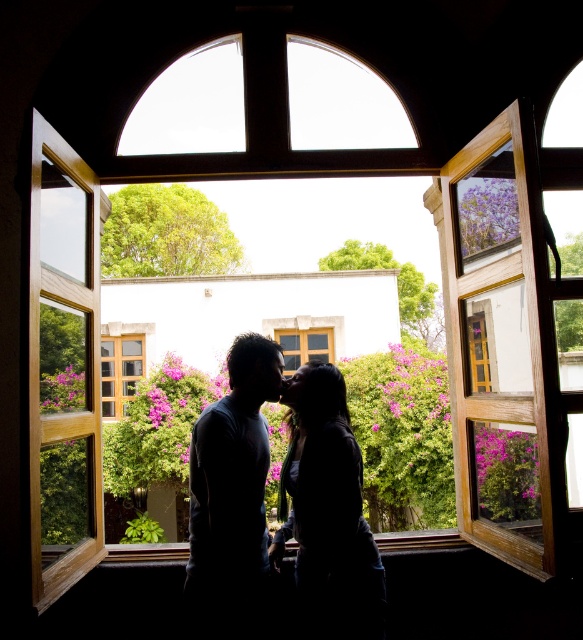
Question: Observing the image, what is the correct spatial positioning of black matte couple at center in reference to wooden frame at left?

Choices:
 (A) below
 (B) above

Answer: (A)

Question: Which of the following is the farthest from the observer?

Choices:
 (A) (209, 516)
 (B) (89, 188)
 (C) (117, 323)

Answer: (C)

Question: Is wooden frame at left to the right of wooden window at center from the viewer's perspective?

Choices:
 (A) yes
 (B) no

Answer: (A)

Question: Does black matte couple at center appear over wooden frame at left?

Choices:
 (A) no
 (B) yes

Answer: (A)

Question: Estimate the real-world distances between objects in this image. Which object is closer to the black matte couple at center?

Choices:
 (A) wooden window at center
 (B) wooden frame at left

Answer: (B)

Question: Which object is the farthest from the black matte couple at center?

Choices:
 (A) wooden frame at left
 (B) wooden window at center

Answer: (B)